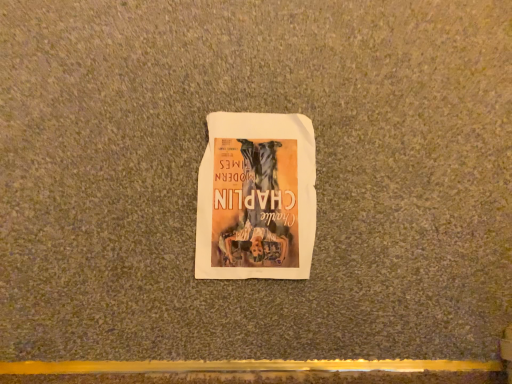
You are a GUI agent. You are given a task and a screenshot of the screen. Output one action in this format:
    pyautogui.click(x=<x>, y=<y>)
    Task: Click on the vacant point above matte paper poster at center (from a real-world perspective)
    
    Given the screenshot: What is the action you would take?
    pyautogui.click(x=254, y=187)